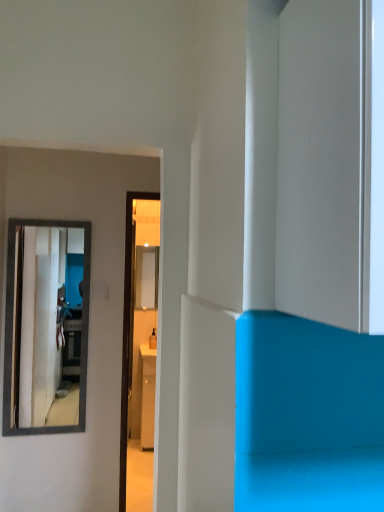
Describe the element at coordinates (43, 329) in the screenshot. The width and height of the screenshot is (384, 512). I see `matte glass mirror at left` at that location.

Measure the distance between point (86, 312) and camera.

The depth of point (86, 312) is 8.53 feet.

Where is `matte glass mirror at left`? This screenshot has height=512, width=384. matte glass mirror at left is located at coordinates (43, 329).

This screenshot has height=512, width=384. Identify the location of matte glass mirror at left. (43, 329).